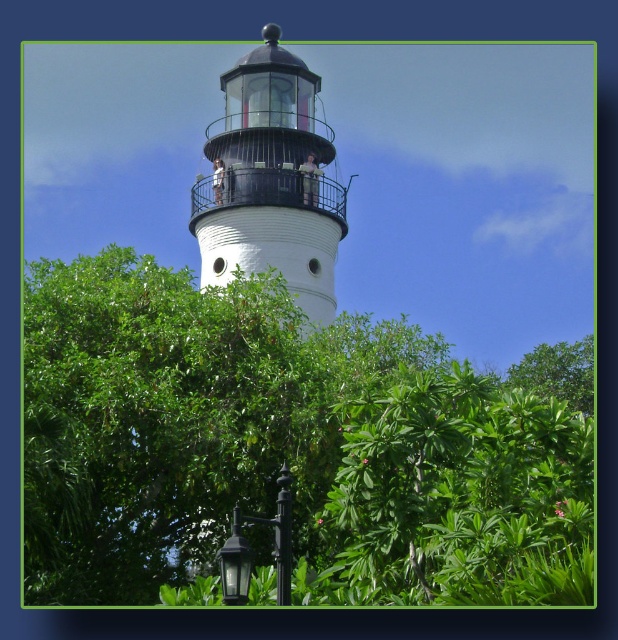
You are standing at the entrance of the lighthouse and want to find the green leafy tree at center. According to the scene description, where should you look relative to your position?

The green leafy tree at center is located at the coordinates point (289, 444), so you should look towards the center of the scene to find it.